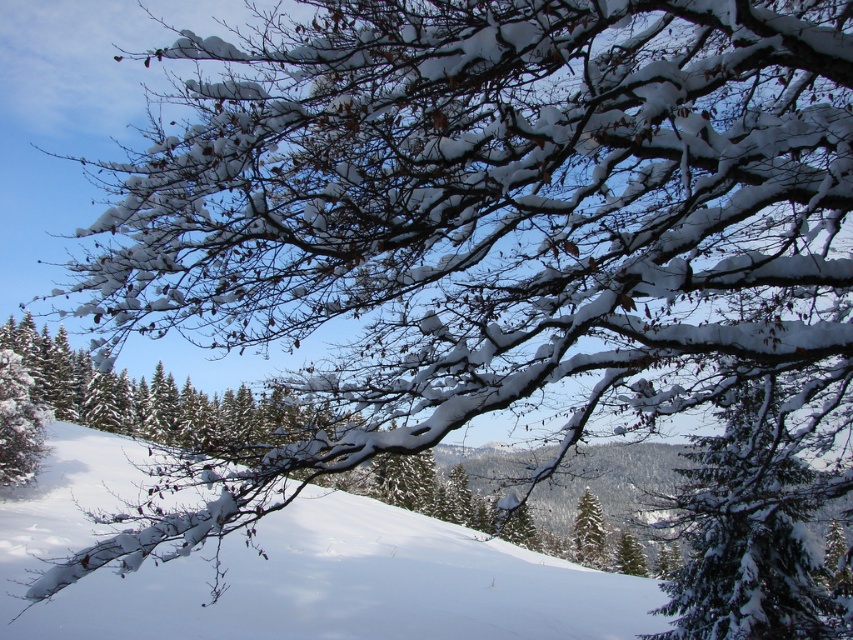
Can you confirm if white snow at center is positioned to the right of green matte tree at center?

In fact, white snow at center is to the left of green matte tree at center.

I want to click on white snow at center, so click(x=294, y=570).

Where is `white snow at center`? white snow at center is located at coordinates (294, 570).

Is snow-covered branch at upper right behind green matte tree at center?

That is False.

Is point (735, 419) farther from camera compared to point (577, 522)?

No, it is in front of (577, 522).

Between point (758, 561) and point (590, 525), which one is positioned in front?

Point (758, 561)

I want to click on snow-covered branch at upper right, so click(x=751, y=532).

Between white snow at center and snow-covered branch at upper right, which one appears on the right side from the viewer's perspective?

snow-covered branch at upper right

Is white snow at center bigger than snow-covered branch at upper right?

Yes, white snow at center is bigger than snow-covered branch at upper right.

Does point (253, 588) come farther from viewer compared to point (752, 616)?

That is True.

This screenshot has height=640, width=853. I want to click on white snow at center, so click(294, 570).